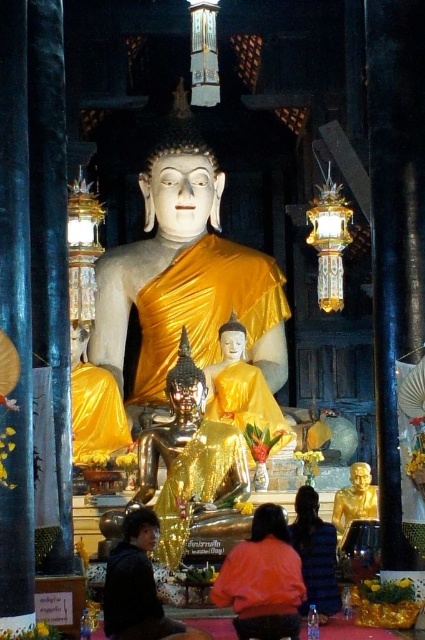
Can you confirm if shiny gold statue at center is shorter than orange matte robe at center?

In fact, shiny gold statue at center may be taller than orange matte robe at center.

Image resolution: width=425 pixels, height=640 pixels. What do you see at coordinates (189, 460) in the screenshot? I see `shiny gold statue at center` at bounding box center [189, 460].

Where is `shiny gold statue at center`? shiny gold statue at center is located at coordinates (189, 460).

Is point (204, 458) farther from camera compared to point (351, 508)?

That is False.

Describe the element at coordinates (189, 460) in the screenshot. I see `shiny gold statue at center` at that location.

Find the location of a particular element. The width and height of the screenshot is (425, 640). shiny gold statue at center is located at coordinates (189, 460).

Can you confirm if matte gold statue at center is positioned to the left of orange matte robe at center?

Yes, matte gold statue at center is to the left of orange matte robe at center.

Does point (195, 266) come closer to viewer compared to point (240, 548)?

No, it is not.

Is point (214, 292) in front of point (249, 547)?

No, it is not.

Identify the location of matte gold statue at center. (x=186, y=278).